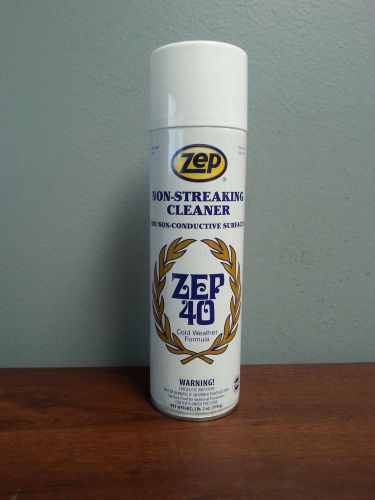
Locate an element on the screen. wooden surface is located at coordinates (273, 468).